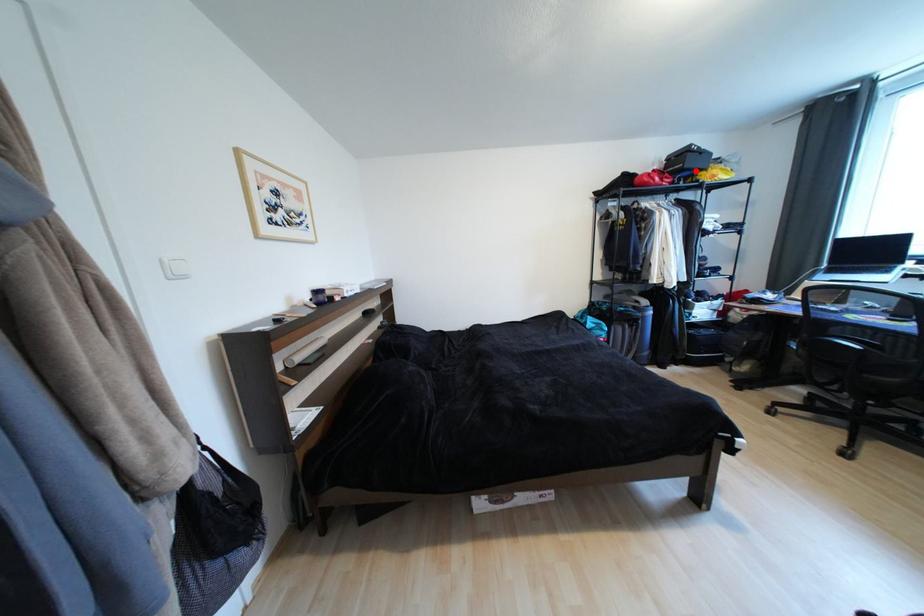
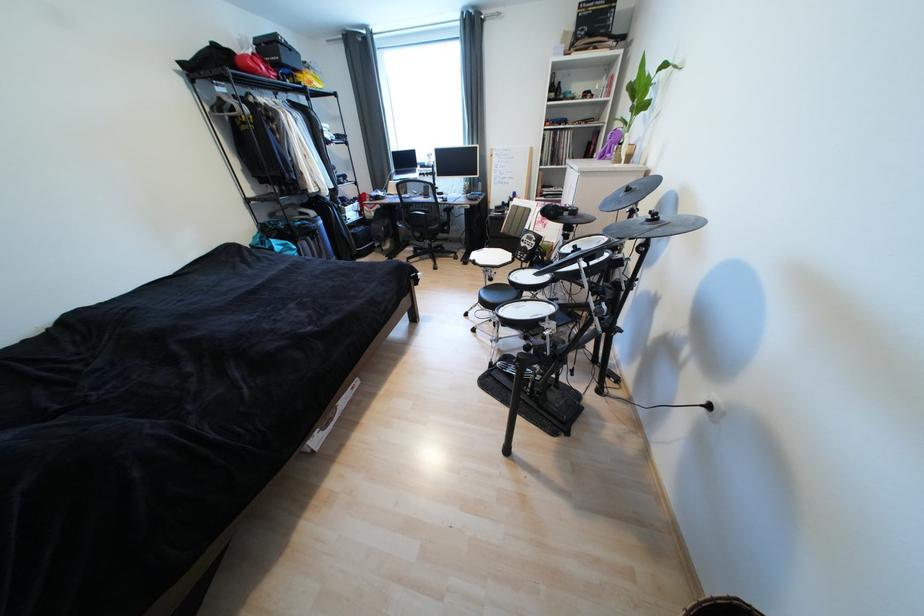
Find the pixel in the second image that matches the highlighted location in the first image.

(294, 68)